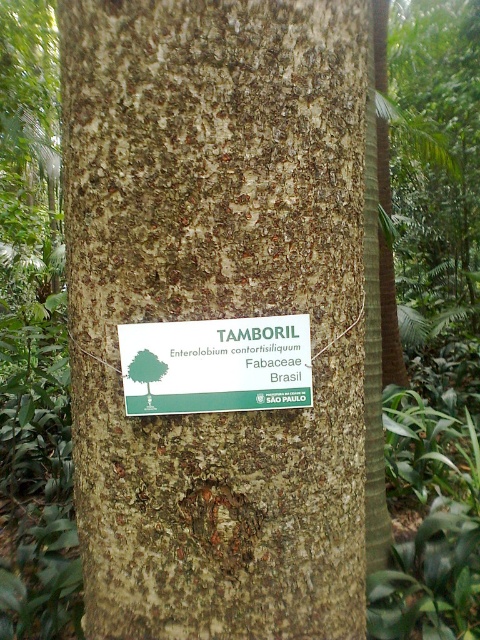
Question: Among these points, which one is nearest to the camera?

Choices:
 (A) (372, 452)
 (B) (279, 353)

Answer: (B)

Question: Does brown rough bark at center have a lesser width compared to green paper sign at center?

Choices:
 (A) no
 (B) yes

Answer: (A)

Question: Which object is farther from the camera taking this photo?

Choices:
 (A) rough bark tree trunk at center
 (B) brown rough bark at center

Answer: (A)

Question: Does brown rough bark at center have a smaller size compared to rough bark tree trunk at center?

Choices:
 (A) yes
 (B) no

Answer: (A)

Question: Based on their relative distances, which object is nearer to the green paper sign at center?

Choices:
 (A) rough bark tree trunk at center
 (B) brown rough bark at center

Answer: (B)

Question: Is green paper sign at center closer to the viewer compared to rough bark tree trunk at center?

Choices:
 (A) no
 (B) yes

Answer: (B)